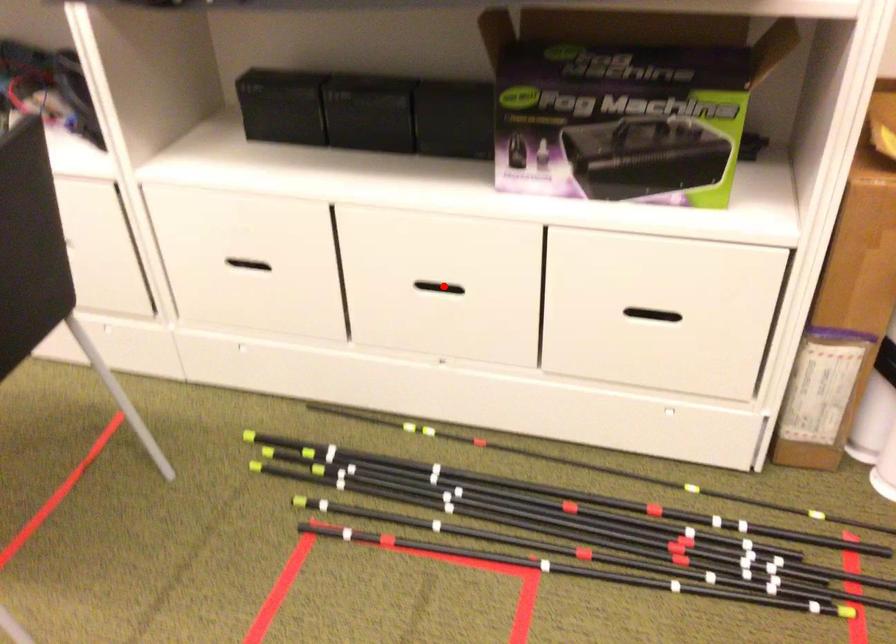
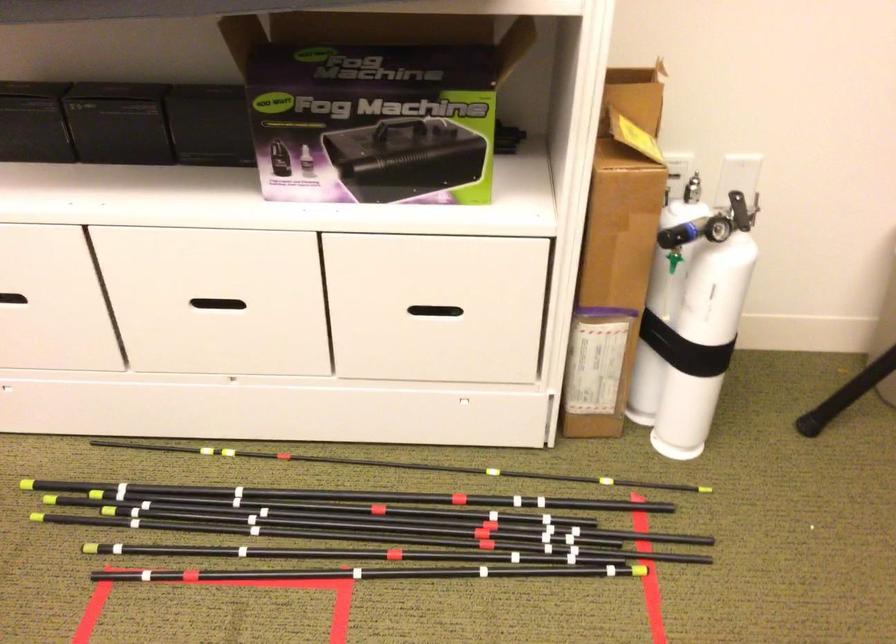
Question: I am providing you with two images of the same scene from different viewpoints. Given a red point in image1, look at the same physical point in image2. Is it:

Choices:
 (A) Closer to the viewpoint
 (B) Farther from the viewpoint

Answer: (A)